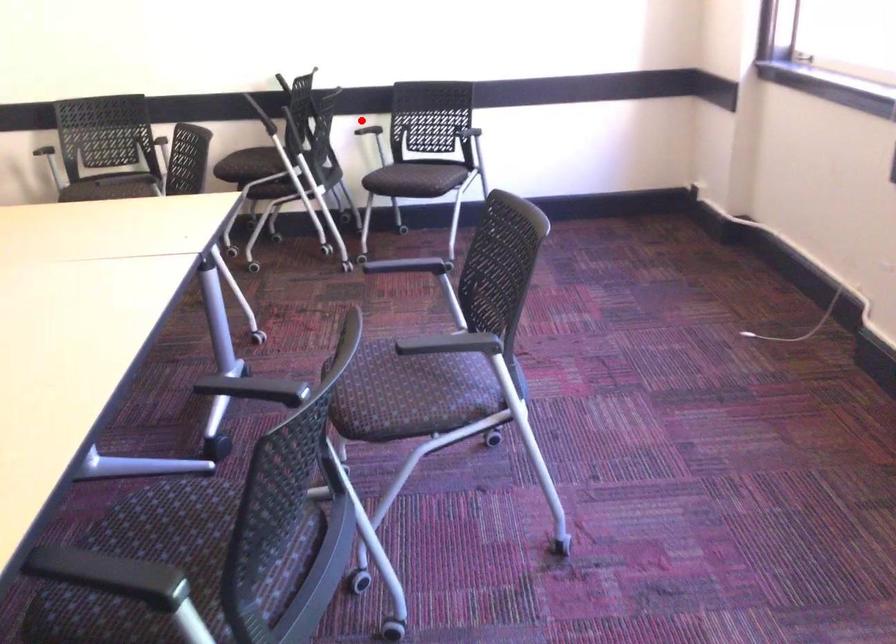
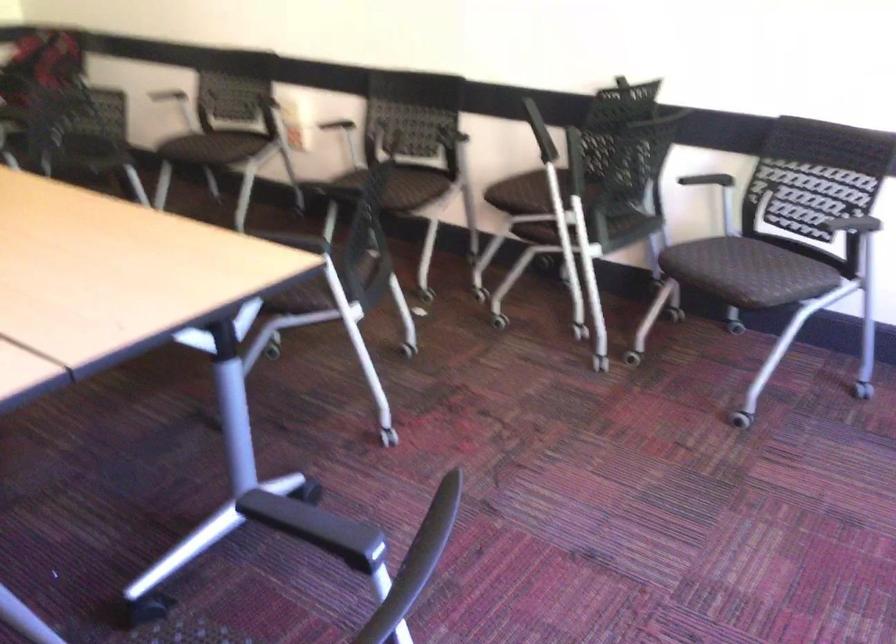
Question: I am providing you with two images of the same scene from different viewpoints. Image1 has a red point marked. In image2, the corresponding 3D location appears at what relative position? Reply with the corresponding letter.

Choices:
 (A) Closer
 (B) Farther

Answer: (A)